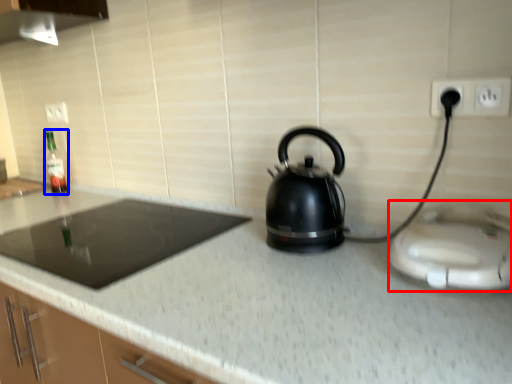
Question: Which object appears closest to the camera in this image, appliance (highlighted by a red box) or bottle (highlighted by a blue box)?

Choices:
 (A) appliance
 (B) bottle

Answer: (A)